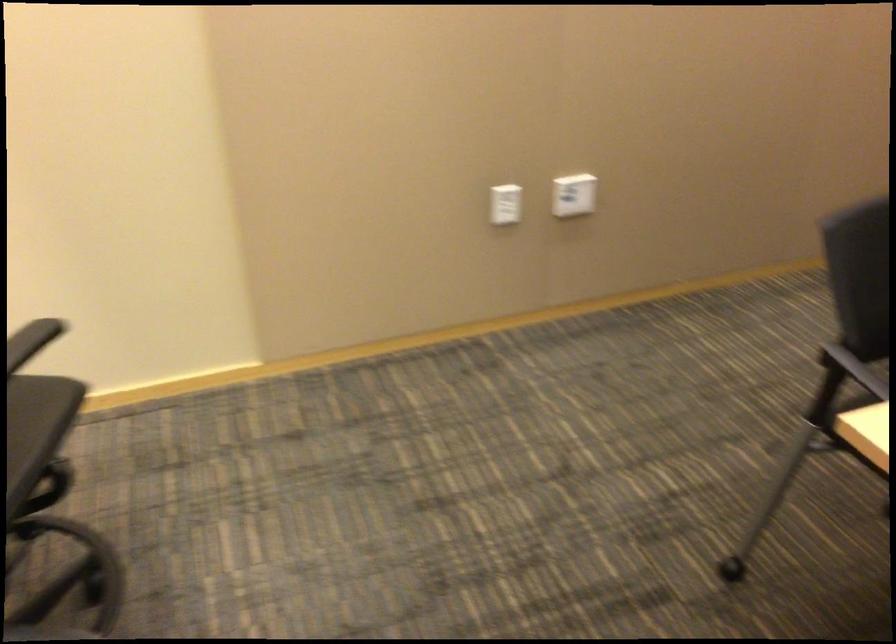
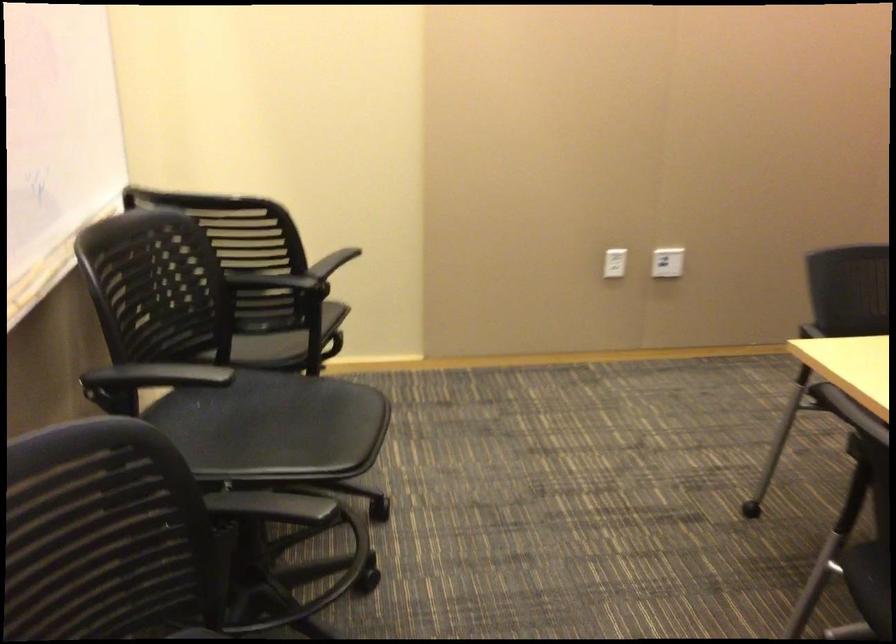
Where in the second image is the point corresponding to (x=569, y=196) from the first image?

(667, 261)